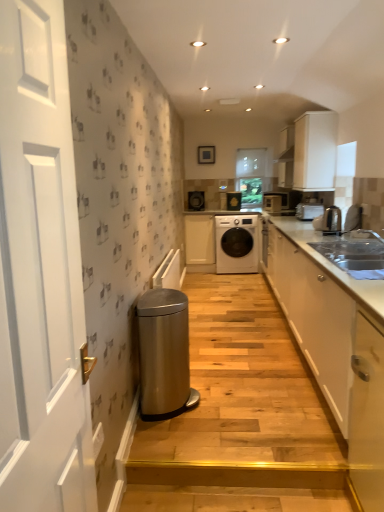
Where is `free space in front of satin silver water heater at lower left`? The height and width of the screenshot is (512, 384). free space in front of satin silver water heater at lower left is located at coordinates (184, 440).